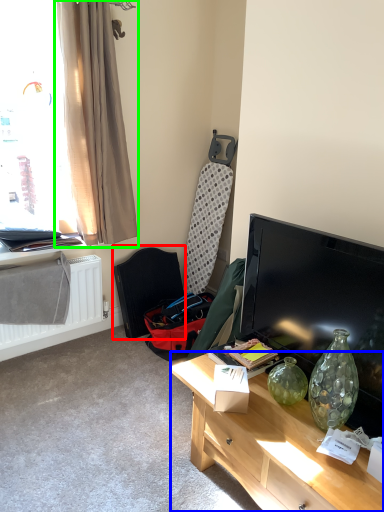
Question: Which object is the closest to the swivel chair (highlighted by a red box)? Choose among these: desk (highlighted by a blue box) or curtain (highlighted by a green box).

Choices:
 (A) desk
 (B) curtain

Answer: (B)